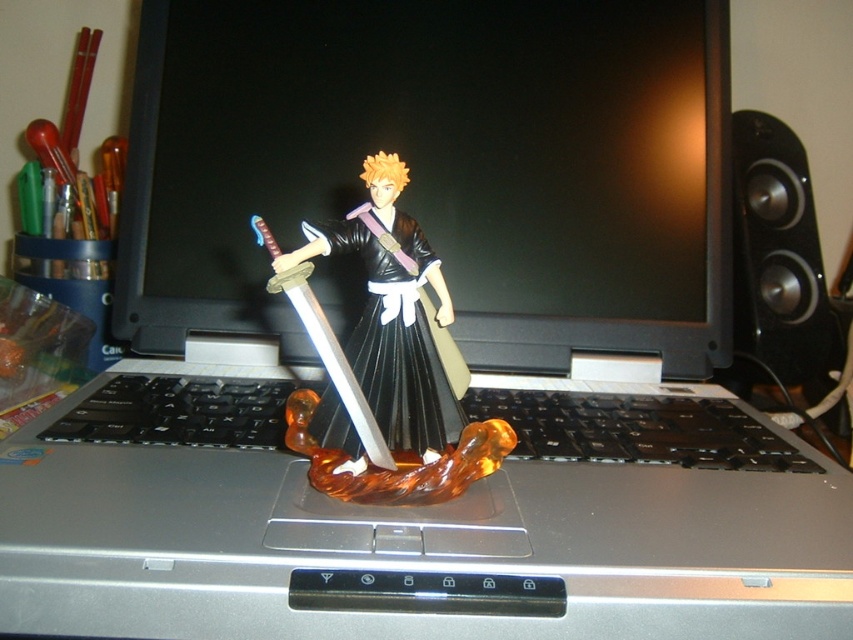
Question: Is black plastic speaker at right bigger than shiny silver sword at center?

Choices:
 (A) no
 (B) yes

Answer: (B)

Question: Estimate the real-world distances between objects in this image. Which object is farther from the shiny silver sword at center?

Choices:
 (A) translucent amber base at center
 (B) black plastic keyboard at center
 (C) black plastic speaker at right

Answer: (C)

Question: Does translucent amber base at center appear on the right side of shiny silver sword at center?

Choices:
 (A) yes
 (B) no

Answer: (A)

Question: Which of the following is the farthest from the observer?

Choices:
 (A) translucent amber base at center
 (B) shiny silver sword at center
 (C) black plastic speaker at right

Answer: (C)

Question: Is black plastic speaker at right to the left of shiny silver sword at center from the viewer's perspective?

Choices:
 (A) no
 (B) yes

Answer: (A)

Question: Which of these objects is positioned farthest from the shiny silver sword at center?

Choices:
 (A) black plastic keyboard at center
 (B) translucent amber base at center

Answer: (A)